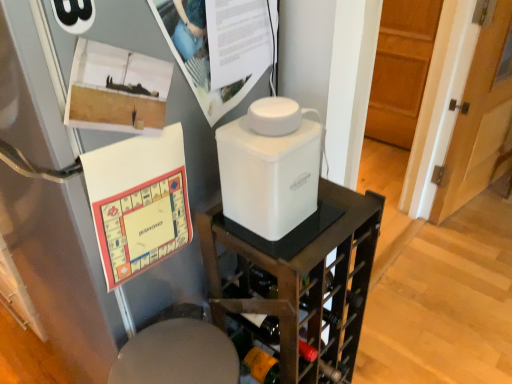
This screenshot has width=512, height=384. What are the coordinates of `free point above white plastic container at center (from a real-world perspective)` in the screenshot? It's located at (272, 135).